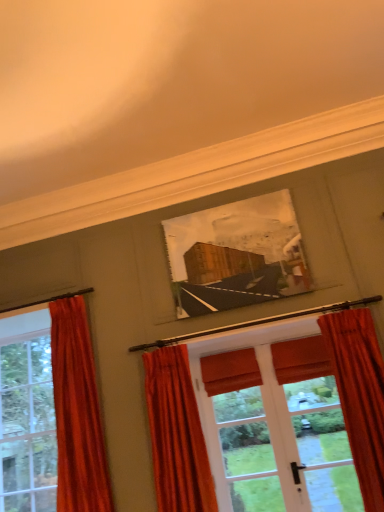
Question: Are velvet orange curtain at lower right, placed as the first curtain when sorted from right to left, and velvet orange curtain at center, which is the 2th curtain from right to left, far apart?

Choices:
 (A) no
 (B) yes

Answer: (B)

Question: Could velvet orange curtain at center, the second curtain viewed from the left, be considered to be inside velvet orange curtain at lower right, the 3th curtain when ordered from left to right?

Choices:
 (A) yes
 (B) no

Answer: (B)

Question: Is velvet orange curtain at lower right, the 3th curtain when ordered from left to right, smaller than velvet orange curtain at center, which is the 2th curtain from right to left?

Choices:
 (A) yes
 (B) no

Answer: (A)

Question: Could you tell me if velvet orange curtain at lower right, the 3th curtain when ordered from left to right, is turned towards velvet orange curtain at center, the second curtain viewed from the left?

Choices:
 (A) no
 (B) yes

Answer: (A)

Question: Is velvet orange curtain at lower right, placed as the first curtain when sorted from right to left, further to camera compared to velvet orange curtain at center, the second curtain viewed from the left?

Choices:
 (A) yes
 (B) no

Answer: (B)

Question: Does velvet orange curtain at lower right, the 3th curtain when ordered from left to right, appear on the left side of velvet orange curtain at center, which is the 2th curtain from right to left?

Choices:
 (A) yes
 (B) no

Answer: (B)

Question: Is velvet orange curtain at center, the second curtain viewed from the left, placed right next to velvet red curtain at left, the 3th curtain when ordered from right to left?

Choices:
 (A) no
 (B) yes

Answer: (A)

Question: Is velvet orange curtain at center, which is the 2th curtain from right to left, to the right of velvet red curtain at left, the 3th curtain when ordered from right to left, from the viewer's perspective?

Choices:
 (A) no
 (B) yes

Answer: (B)

Question: Can you confirm if velvet orange curtain at center, which is the 2th curtain from right to left, is taller than velvet red curtain at left, the 1th curtain in the left-to-right sequence?

Choices:
 (A) yes
 (B) no

Answer: (B)

Question: Can you confirm if velvet orange curtain at center, the second curtain viewed from the left, is wider than velvet red curtain at left, the 1th curtain in the left-to-right sequence?

Choices:
 (A) no
 (B) yes

Answer: (A)

Question: From the image's perspective, would you say velvet orange curtain at center, the second curtain viewed from the left, is shown under velvet red curtain at left, the 3th curtain when ordered from right to left?

Choices:
 (A) yes
 (B) no

Answer: (A)

Question: Does velvet orange curtain at center, which is the 2th curtain from right to left, turn towards velvet red curtain at left, the 3th curtain when ordered from right to left?

Choices:
 (A) no
 (B) yes

Answer: (A)

Question: Is velvet orange curtain at lower right, placed as the first curtain when sorted from right to left, turned away from velvet red curtain at left, the 1th curtain in the left-to-right sequence?

Choices:
 (A) yes
 (B) no

Answer: (B)